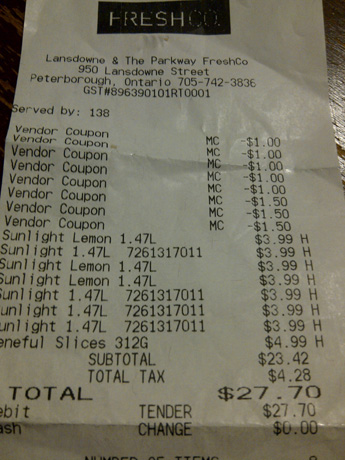
Locate an element on the screen. The image size is (345, 460). wooden table underneath receipt is located at coordinates (11, 39).